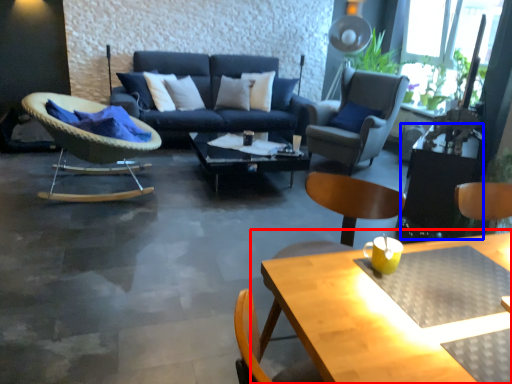
Question: Which point is closer to the camera, table (highlighted by a red box) or side table (highlighted by a blue box)?

Choices:
 (A) table
 (B) side table

Answer: (A)